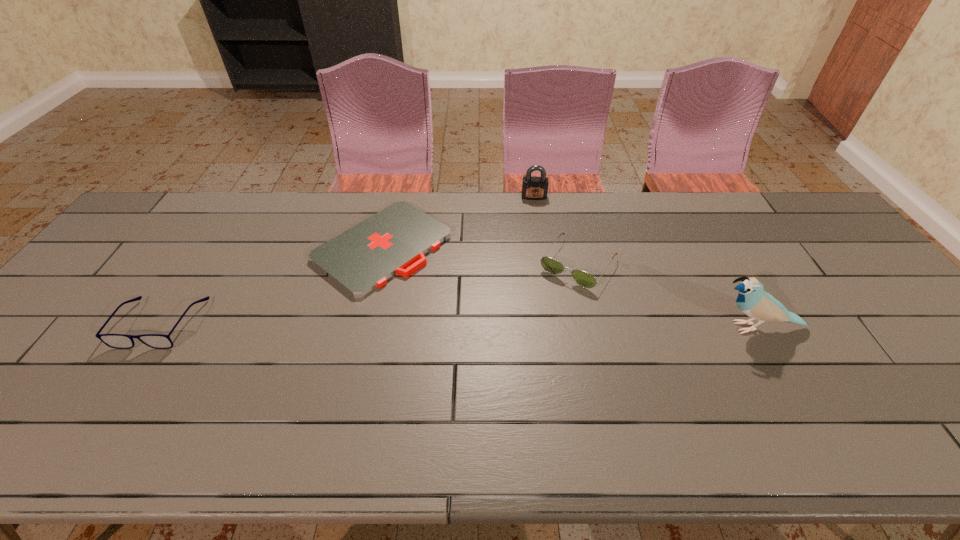
You are a GUI agent. You are given a task and a screenshot of the screen. Output one action in this format:
    pyautogui.click(x=<x>, y=<y>)
    Task: Click on the free region that satisfies the following two spatial constraints: 1. on the front side of the farthest object; 2. on the left side of the sunglasses
    
    Given the screenshot: What is the action you would take?
    pyautogui.click(x=543, y=264)

This screenshot has height=540, width=960. Identify the location of vacant space that satisfies the following two spatial constraints: 1. on the front side of the padlock; 2. at the face of the bird. (553, 327).

Image resolution: width=960 pixels, height=540 pixels. Identify the location of free space that satisfies the following two spatial constraints: 1. on the back side of the shortest object; 2. on the right side of the farthest object. (395, 197).

I want to click on vacant area in the image that satisfies the following two spatial constraints: 1. on the front-facing side of the leftmost object; 2. at the face of the tallest object, so click(158, 327).